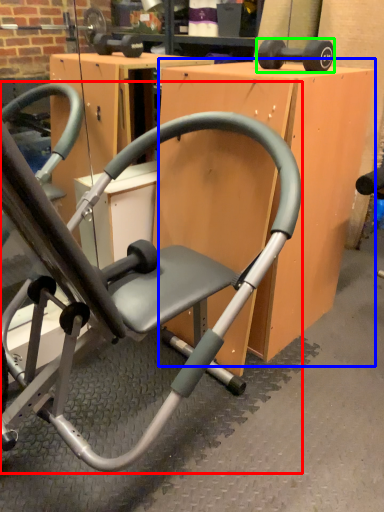
Question: Which object is positioned closest to chair (highlighted by a red box)? Select from table (highlighted by a blue box) and dumbbell (highlighted by a green box).

Choices:
 (A) table
 (B) dumbbell

Answer: (A)